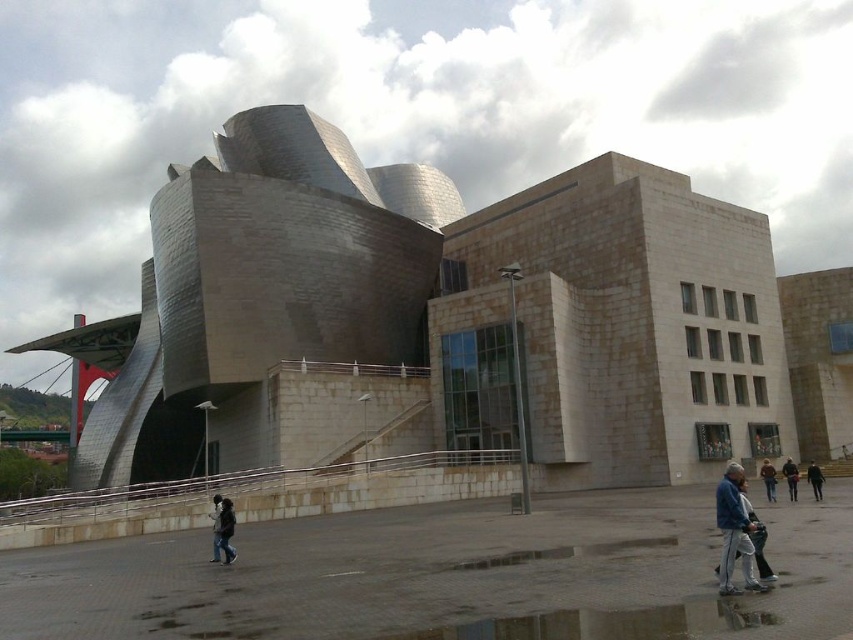
Question: Can you confirm if dark brown leather jacket at lower left is smaller than brown leather jacket at lower right?

Choices:
 (A) yes
 (B) no

Answer: (A)

Question: Which point is farther from the camera taking this photo?

Choices:
 (A) (726, 572)
 (B) (793, 467)

Answer: (B)

Question: Is polished steel building at center above light gray fabric jacket at lower right?

Choices:
 (A) yes
 (B) no

Answer: (A)

Question: Which point is farther from the camera taking this photo?

Choices:
 (A) (666, 620)
 (B) (782, 474)
 (C) (756, 545)
 (D) (694, 248)

Answer: (D)

Question: Is blue denim jacket at lower right to the left of brown leather jacket at lower right from the viewer's perspective?

Choices:
 (A) yes
 (B) no

Answer: (A)

Question: Which of the following is the farthest from the observer?

Choices:
 (A) (722, 561)
 (B) (791, 461)
 (C) (218, 509)
 (D) (819, 484)

Answer: (B)